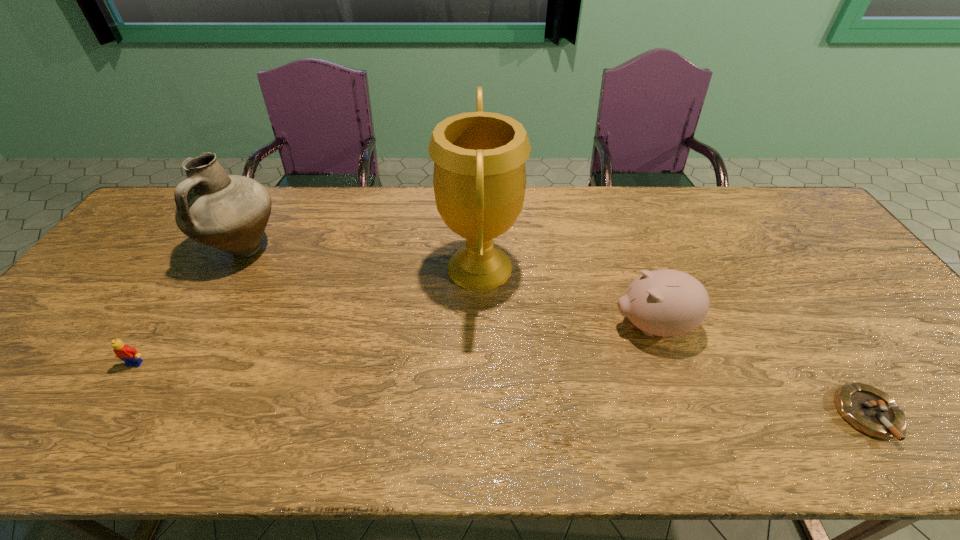
Where is `blank region between the Lego and the fourth object from left to right`? blank region between the Lego and the fourth object from left to right is located at coordinates (394, 345).

Where is `unoccupied area between the rightmost object and the fourth object from left to right`? unoccupied area between the rightmost object and the fourth object from left to right is located at coordinates (760, 370).

Locate an element on the screen. vacant area between the fourth farthest object and the pitcher is located at coordinates (190, 306).

Identify which object is located as the third nearest to the third object from right to left. Please provide its 2D coordinates. Your answer should be formatted as a tuple, i.e. [(x, y)], where the tuple contains the x and y coordinates of a point satisfying the conditions above.

[(129, 355)]

Identify which object is located as the second nearest to the second object from right to left. Please provide its 2D coordinates. Your answer should be formatted as a tuple, i.e. [(x, y)], where the tuple contains the x and y coordinates of a point satisfying the conditions above.

[(868, 409)]

Identify the location of free point that satisfies the following two spatial constraints: 1. at the snout of the rightmost object; 2. on the left side of the third tallest object. The image size is (960, 540). [x=684, y=415].

The height and width of the screenshot is (540, 960). In order to click on free space that satisfies the following two spatial constraints: 1. on the engravings side of the rightmost object; 2. on the left side of the third object from left to right in this screenshot , I will do `click(480, 415)`.

This screenshot has width=960, height=540. In order to click on free location that satisfies the following two spatial constraints: 1. on the face of the second nearest object; 2. on the left side of the ashtray in this screenshot , I will do `click(102, 415)`.

The image size is (960, 540). Identify the location of vacant region that satisfies the following two spatial constraints: 1. on the face of the rightmost object; 2. on the left side of the fourth farthest object. (102, 415).

The image size is (960, 540). In order to click on free space in the image that satisfies the following two spatial constraints: 1. on the handle side of the fourth shortest object; 2. on the left side of the nearest object in this screenshot , I will do `click(151, 415)`.